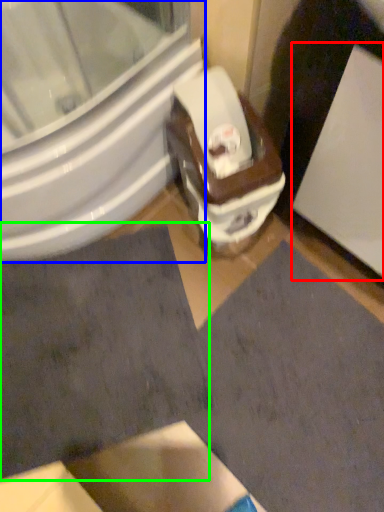
Question: Which object is the farthest from screen door (highlighted by a red box)? Choose among these: bidet (highlighted by a blue box) or square (highlighted by a green box).

Choices:
 (A) bidet
 (B) square

Answer: (B)